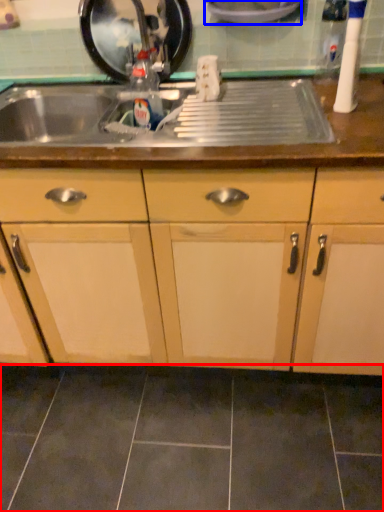
Question: Which object is closer to the camera taking this photo, ceramic tile (highlighted by a red box) or appliance (highlighted by a blue box)?

Choices:
 (A) ceramic tile
 (B) appliance

Answer: (A)